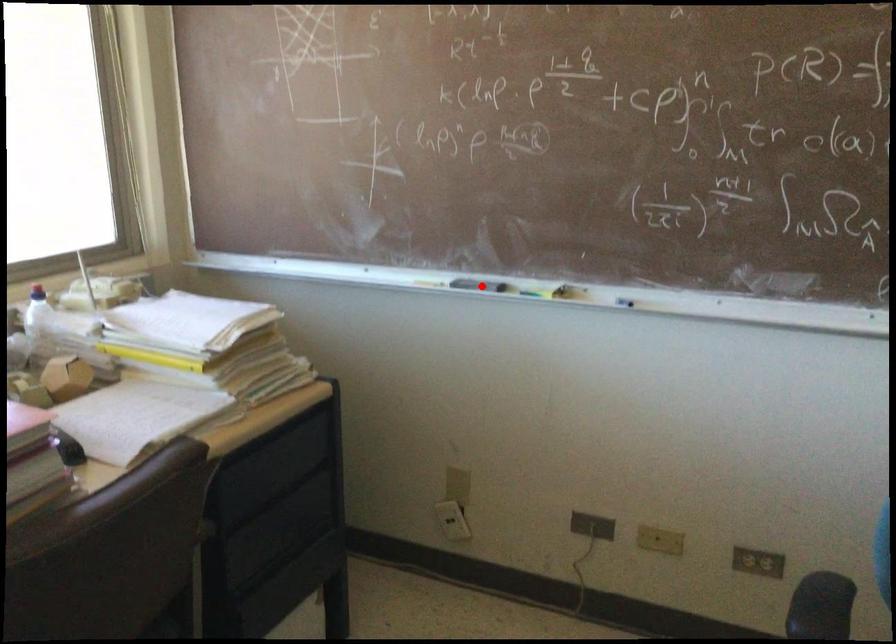
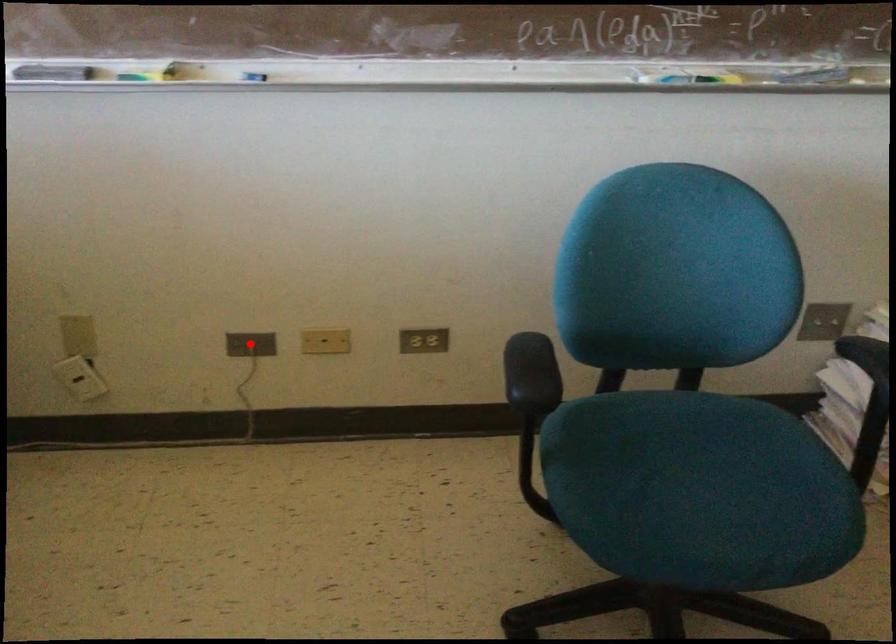
I am providing you with two images of the same scene from different viewpoints. A red point is marked on the first image and another point is marked on the second image. Are the points marked in image1 and image2 representing the same 3D position?

No